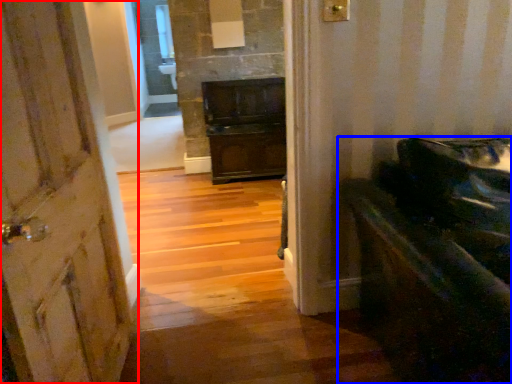
Question: Which point is further to the camera, door (highlighted by a red box) or furniture (highlighted by a blue box)?

Choices:
 (A) door
 (B) furniture

Answer: (B)